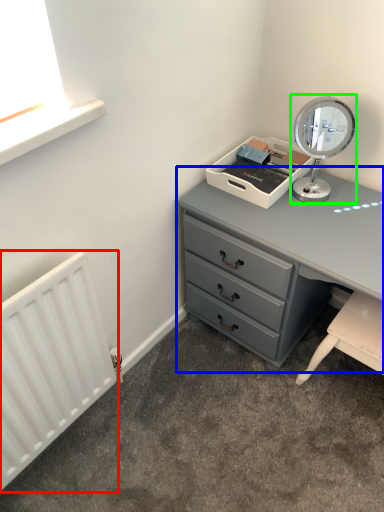
Question: Which is nearer to the radiator (highlighted by a red box)? chest of drawers (highlighted by a blue box) or table lamp (highlighted by a green box).

Choices:
 (A) chest of drawers
 (B) table lamp

Answer: (A)